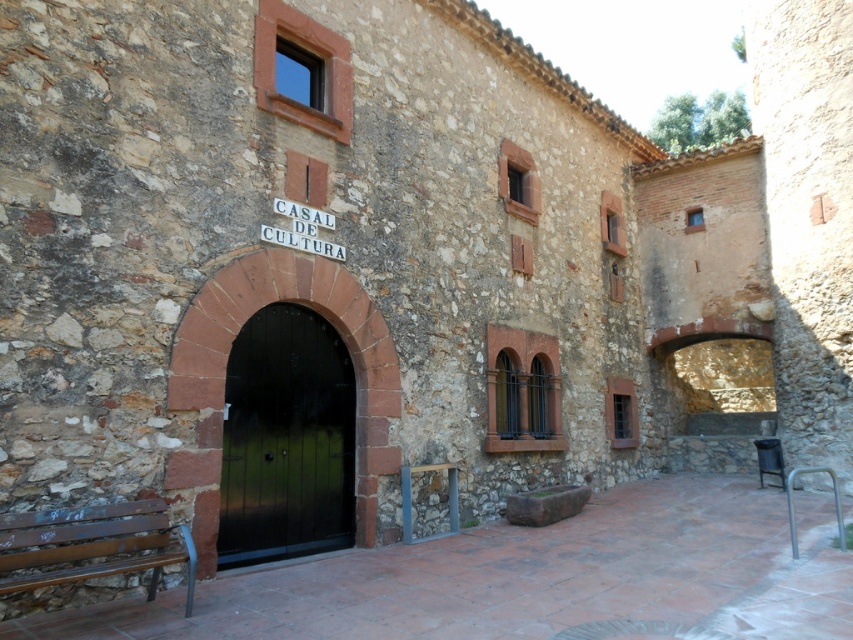
Can you confirm if brown wooden bench at lower left is positioned above black wooden door at center?

Actually, brown wooden bench at lower left is below black wooden door at center.

Measure the distance between brown wooden bench at lower left and black wooden door at center.

brown wooden bench at lower left is 2.17 meters away from black wooden door at center.

Which is in front, point (741, 579) or point (326, 476)?

Point (741, 579) is more forward.

Locate an element on the screen. brown wooden bench at lower left is located at coordinates (532, 579).

Can you confirm if black wooden door at center is bigger than rustic wood bench at lower left?

Indeed, black wooden door at center has a larger size compared to rustic wood bench at lower left.

Is point (347, 524) closer to viewer compared to point (0, 545)?

No, (347, 524) is behind (0, 545).

Locate an element on the screen. The width and height of the screenshot is (853, 640). black wooden door at center is located at coordinates (286, 440).

Which is in front, point (244, 624) or point (54, 540)?

Point (54, 540) is in front.

Does brown wooden bench at lower left appear under rustic wood bench at lower left?

Yes, brown wooden bench at lower left is below rustic wood bench at lower left.

Identify the location of brown wooden bench at lower left. (532, 579).